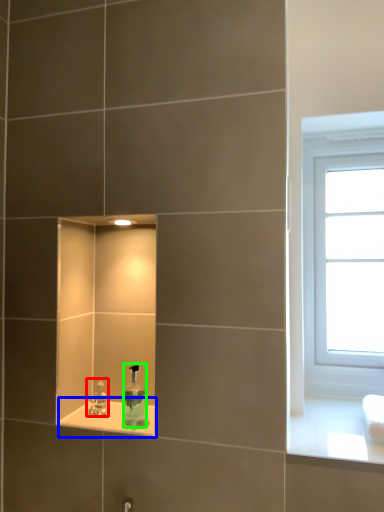
Question: Based on their relative distances, which object is nearer to tap (highlighted by a red box)? Choose from window sill (highlighted by a blue box) and soap dispenser (highlighted by a green box).

Choices:
 (A) window sill
 (B) soap dispenser

Answer: (A)